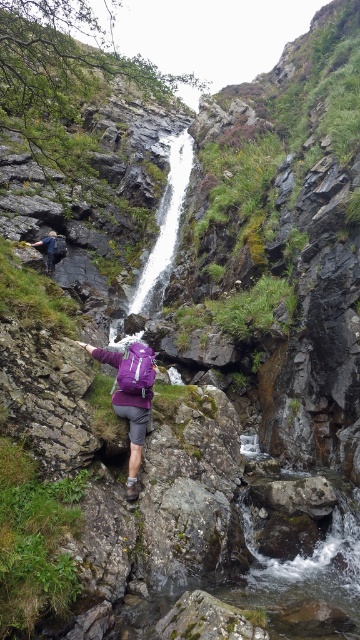
You are a hiker trying to reach the base of the white smooth waterfall at center. Based on the scene description, which direction should you move from your current position to get there?

The white smooth waterfall at center is located at point (164, 224), so you should move towards the center of the image to reach its base.

You are a hiker who wants to take a photo of the white smooth waterfall at center and the purple fabric backpack at lower left. Which object should you focus on first if you want to capture both in one frame without moving the camera?

Since the white smooth waterfall at center is larger in size compared to the purple fabric backpack at lower left, you should focus on the waterfall first as it occupies more space in the frame, ensuring both objects are clearly visible.